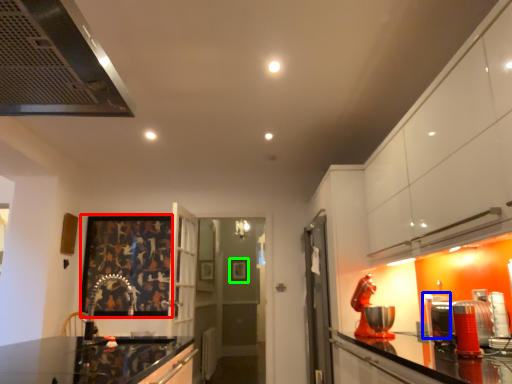
Question: Based on their relative distances, which object is farther from picture frame (highlighted by a red box)? Choose from appliance (highlighted by a blue box) and picture frame (highlighted by a green box).

Choices:
 (A) appliance
 (B) picture frame

Answer: (A)